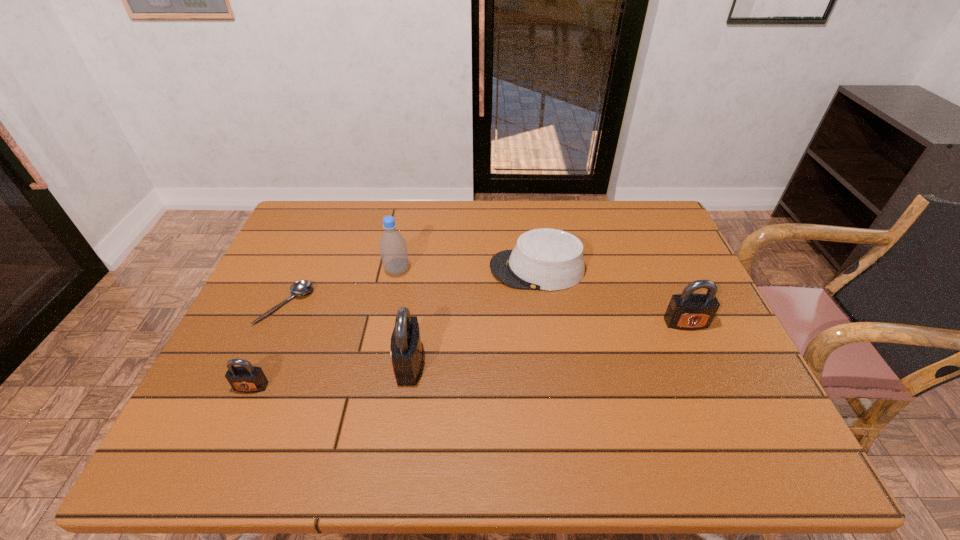
The image size is (960, 540). In order to click on the leftmost padlock in this screenshot , I will do `click(246, 378)`.

Locate an element on the screen. Image resolution: width=960 pixels, height=540 pixels. the second padlock from left to right is located at coordinates click(406, 349).

Locate an element on the screen. This screenshot has width=960, height=540. the third tallest object is located at coordinates (689, 311).

The image size is (960, 540). I want to click on the rightmost object, so click(x=689, y=311).

This screenshot has height=540, width=960. In order to click on the second object from right to left in this screenshot , I will do tap(547, 259).

You are a GUI agent. You are given a task and a screenshot of the screen. Output one action in this format:
    pyautogui.click(x=<x>, y=<y>)
    Task: Click on the fourth object from right to left
    
    Given the screenshot: What is the action you would take?
    pyautogui.click(x=393, y=248)

Where is `ladle`? This screenshot has width=960, height=540. ladle is located at coordinates (299, 288).

Locate an element on the screen. vacant space situated 0.100m on the front of the second padlock from right to left near the keyhole is located at coordinates (353, 363).

This screenshot has height=540, width=960. I want to click on vacant space located on the front of the second padlock from right to left near the keyhole, so click(x=269, y=363).

This screenshot has width=960, height=540. I want to click on vacant area situated on the front of the second padlock from right to left near the keyhole, so click(239, 363).